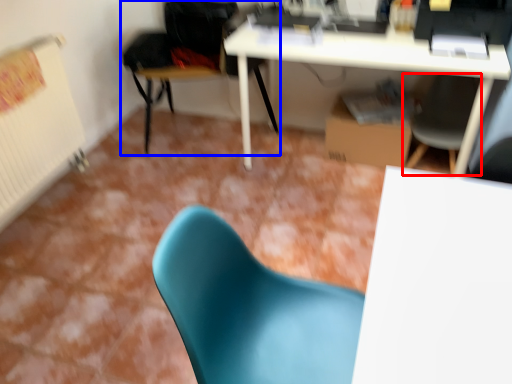
Question: Among these objects, which one is nearest to the camera, chair (highlighted by a red box) or chair (highlighted by a blue box)?

Choices:
 (A) chair
 (B) chair

Answer: (A)